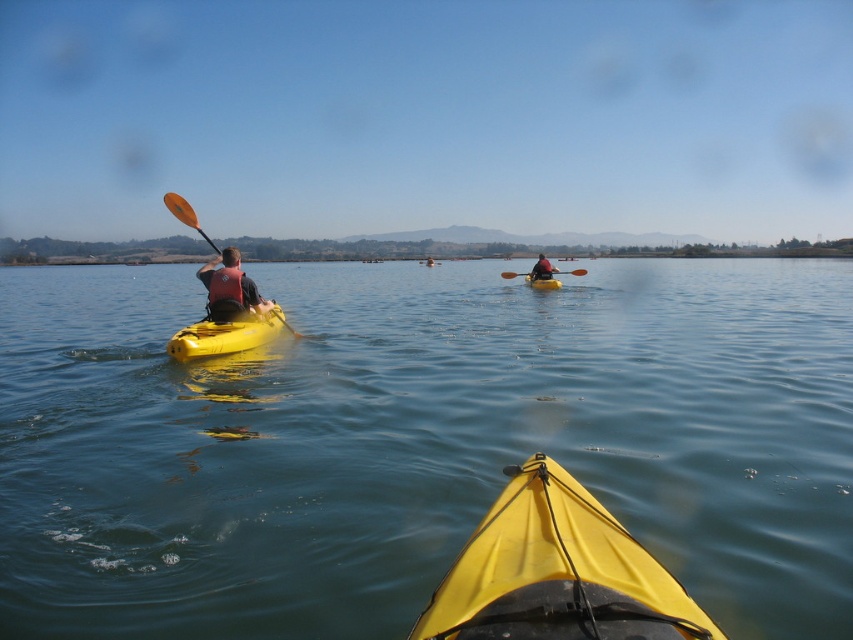
Question: Can you confirm if matte black kayak at center is positioned above yellow matte kayak at center?

Choices:
 (A) no
 (B) yes

Answer: (A)

Question: Which of these objects is positioned farthest from the matte yellow kayak at left?

Choices:
 (A) matte yellow kayak at center
 (B) yellow matte kayak at center
 (C) orange paddle at left

Answer: (A)

Question: Which point is farther from the camera taking this photo?

Choices:
 (A) (531, 276)
 (B) (543, 499)
 (C) (538, 256)
 (D) (184, 330)

Answer: (A)

Question: Can you confirm if clear blue water at center is positioned to the right of matte yellow kayak at center?

Choices:
 (A) yes
 (B) no

Answer: (B)

Question: Does matte black kayak at center have a lesser width compared to yellow matte kayak at center?

Choices:
 (A) no
 (B) yes

Answer: (A)

Question: Which object appears farthest from the camera in this image?

Choices:
 (A) orange paddle at center
 (B) matte black kayak at center
 (C) orange paddle at left
 (D) yellow matte kayak at center

Answer: (A)